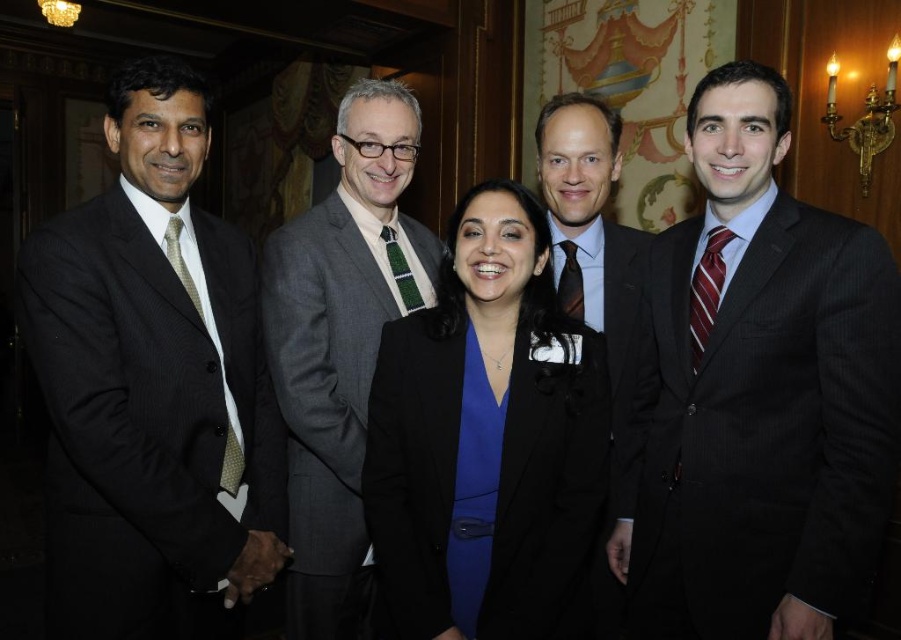
You are a photographer at a formal event. You need to capture a photo of the black pinstripe suit at left and the gray wool suit at center. Based on their positions, which one is positioned higher in the frame?

The black pinstripe suit at left is positioned higher in the frame than the gray wool suit at center.

You are a photographer setting up for a group photo. You need to ensure that the tallest person is positioned in the center for the best composition. Based on the scene description, which of the two individuals wearing the gray wool suit at center and dark gray suit at center should be placed in the center?

The gray wool suit at center should be placed in the center because it is much taller than the dark gray suit at center.

You are standing in the room with the ornate wall tapestry. There is a black pinstripe suit at left represented by point (x=153, y=387). Can you tell me the position of the black pinstripe suit at left relative to the wall tapestry?

The black pinstripe suit at left is located at point (x=153, y=387) relative to the wall tapestry.